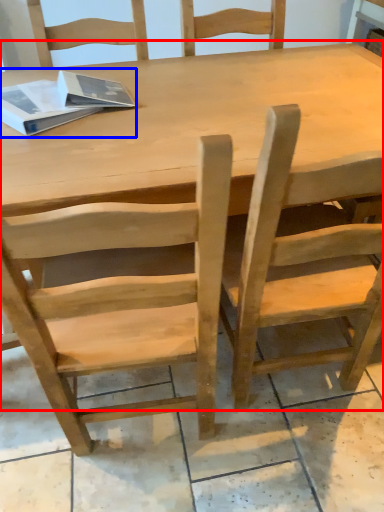
Question: Among these objects, which one is nearest to the camera, table (highlighted by a red box) or book (highlighted by a blue box)?

Choices:
 (A) table
 (B) book

Answer: (A)